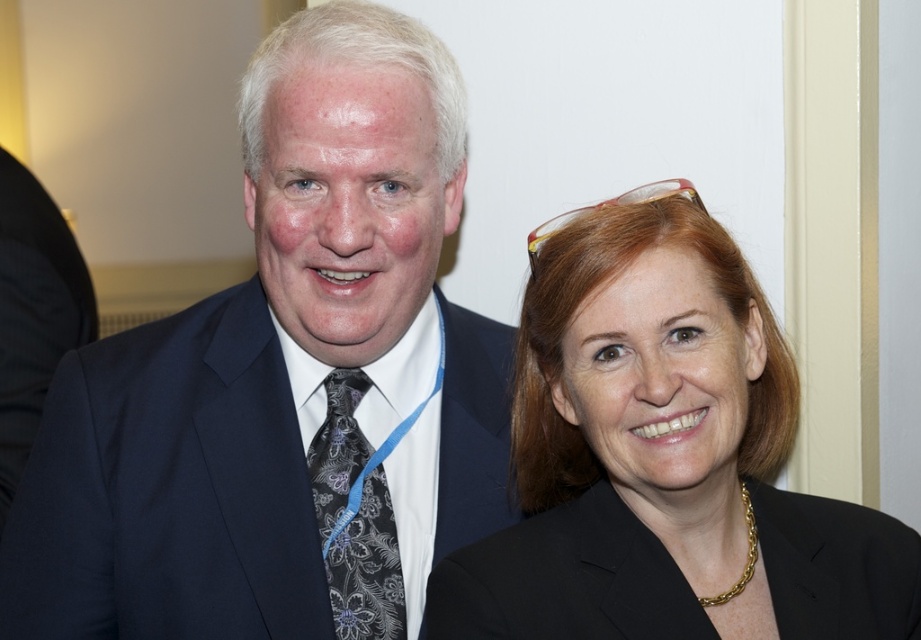
You are taking a photo of two people in a conference. You want to focus on the person closer to the camera. Which coordinate point should you focus on, point (714, 225) or point (672, 598)?

Point (714, 225) is further to the camera than point (672, 598), so you should focus on point (714, 225) to capture the person closer to the camera.

You are a photographer setting up for a group photo and need to arrange two people so that their black blazers are visible. You have the matte black blazer at center and the black matte blazer at lower right. Based on their positions, which blazer is on the left side?

The matte black blazer at center is positioned on the left side of the black matte blazer at lower right, so the matte black blazer at center is on the left.

You are a photographer setting up for a group photo. You need to position the matte black blazer at center and the black matte blazer at lower right so that both are visible in the frame. Based on their sizes, which blazer should you place closer to the camera to ensure both fit well in the photo?

The black matte blazer at lower right is narrower, so placing it closer to the camera would help both blazers fit well in the frame.